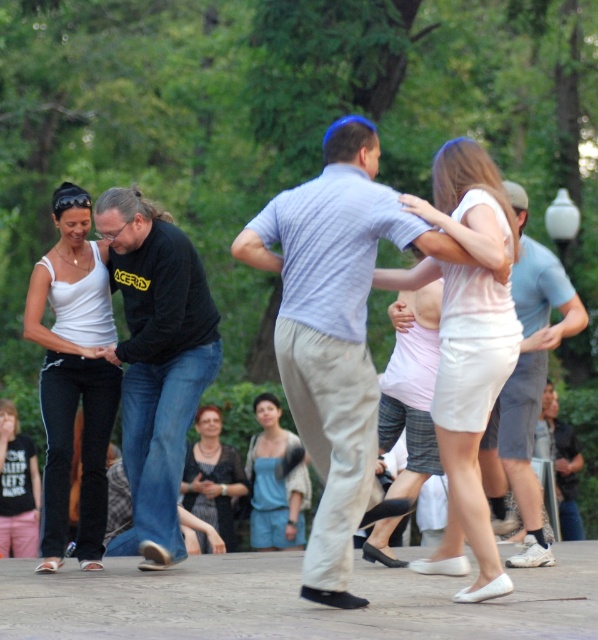
Question: Is denim dress at center bigger than matte black tank top at lower left?

Choices:
 (A) no
 (B) yes

Answer: (A)

Question: Which of the following is the farthest from the observer?

Choices:
 (A) (447, 216)
 (B) (26, 467)

Answer: (B)

Question: Which of the following is the farthest from the observer?

Choices:
 (A) light blue cotton shirt at center
 (B) matte black tank top at lower left

Answer: (B)

Question: Is black cotton shirt at center positioned behind white matte tank top at center?

Choices:
 (A) yes
 (B) no

Answer: (B)

Question: Among these points, which one is farthest from the camera?

Choices:
 (A) (10, 468)
 (B) (511, 433)
 (C) (93, 545)
 (D) (154, 440)

Answer: (A)

Question: Does light blue striped shirt at center have a larger size compared to light blue cotton shirt at center?

Choices:
 (A) yes
 (B) no

Answer: (A)